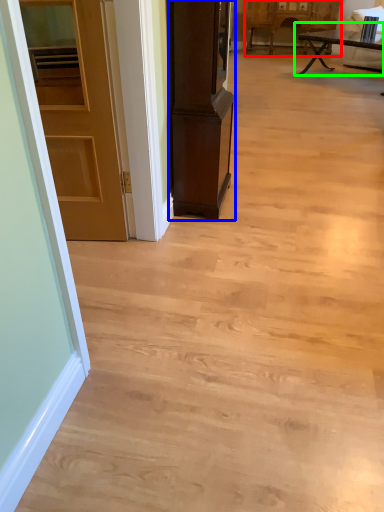
Question: Estimate the real-world distances between objects in this image. Which object is closer to cabinetry (highlighted by a red box), cabinetry (highlighted by a blue box) or table (highlighted by a green box)?

Choices:
 (A) cabinetry
 (B) table

Answer: (B)